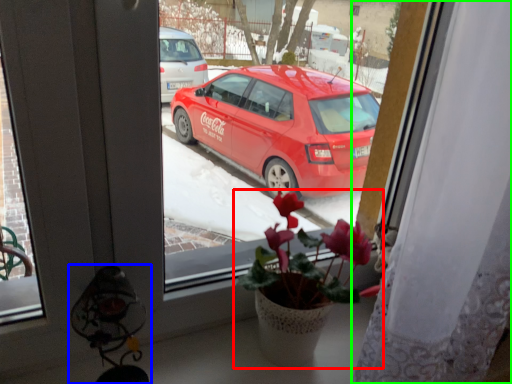
Question: Based on their relative distances, which object is farther from houseplant (highlighted by a red box)? Choose from lamp (highlighted by a blue box) and curtain (highlighted by a green box).

Choices:
 (A) lamp
 (B) curtain

Answer: (A)